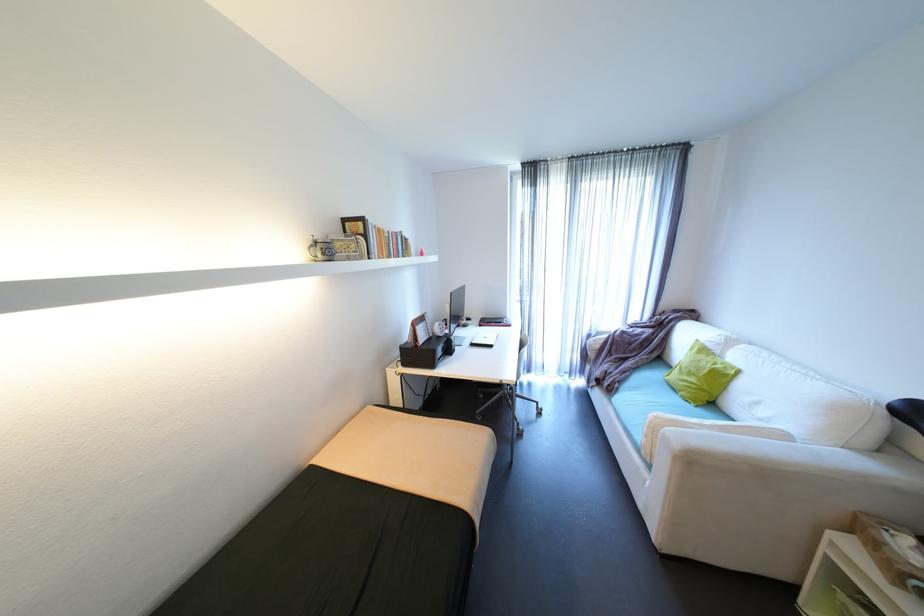
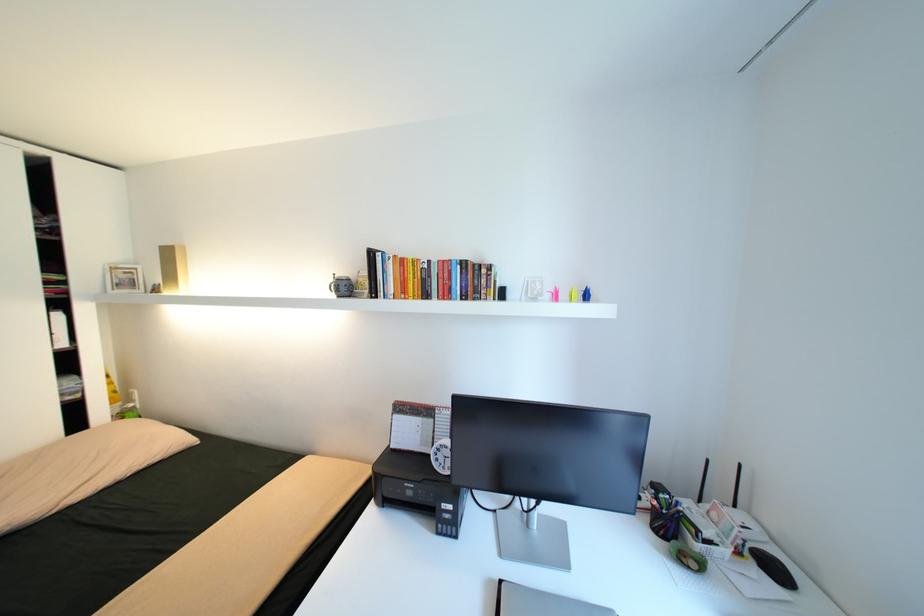
The point at (x=398, y=233) is marked in the first image. Where is the corresponding point in the second image?

(445, 262)